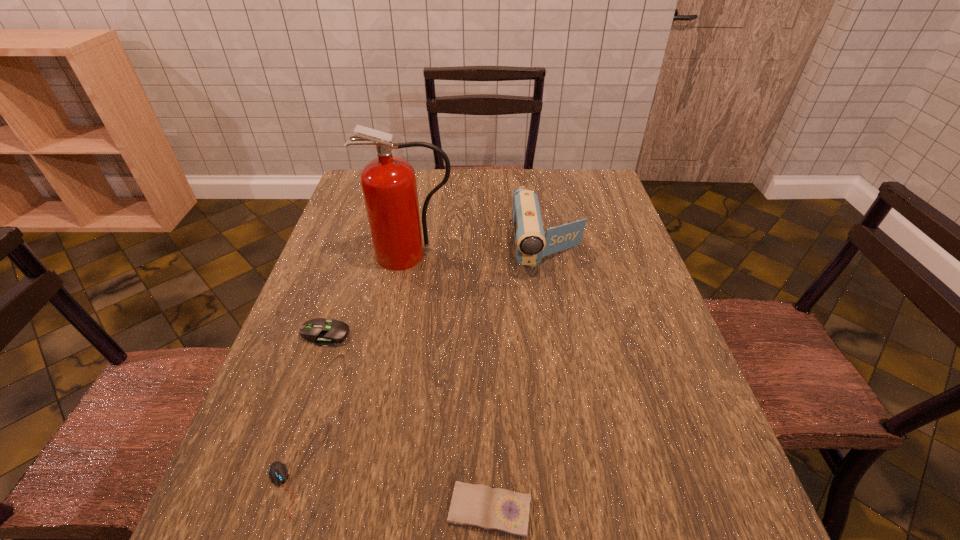
Where is `vacant space located 0.330m on the back of the fourth object from left to right`? The width and height of the screenshot is (960, 540). vacant space located 0.330m on the back of the fourth object from left to right is located at coordinates (487, 338).

At what (x,y) coordinates should I click in order to perform the action: click on vacant region located on the back of the nearer mouse. Please return your answer as a coordinate pair (x, y). The width and height of the screenshot is (960, 540). Looking at the image, I should click on (321, 367).

I want to click on diary located in the near edge section of the desktop, so click(x=474, y=505).

At what (x,y) coordinates should I click in order to perform the action: click on mouse at the near edge. Please return your answer as a coordinate pair (x, y). The width and height of the screenshot is (960, 540). Looking at the image, I should click on (278, 471).

What are the coordinates of `fire extinguisher that is positioned at the left edge` in the screenshot? It's located at (389, 187).

Where is `object that is at the right edge`? This screenshot has width=960, height=540. object that is at the right edge is located at coordinates (531, 242).

The width and height of the screenshot is (960, 540). I want to click on object located at the near left corner, so click(278, 471).

The height and width of the screenshot is (540, 960). Find the location of `vacant space at the far edge of the desktop`. vacant space at the far edge of the desktop is located at coordinates click(492, 188).

Identify the location of free region at the left edge. This screenshot has height=540, width=960. (248, 457).

Find the location of a particular element. The height and width of the screenshot is (540, 960). free space at the right edge of the desktop is located at coordinates (646, 321).